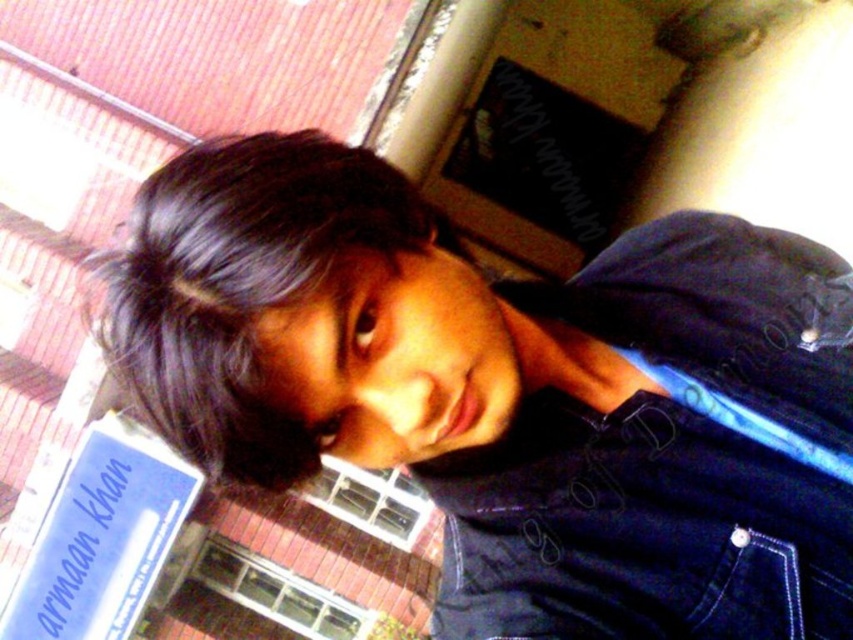
You are a photographer setting up a shoot. You need to place a 2.5 inch wide prop between the dark blue denim jacket at upper right and the navy blue denim jacket at lower right. Can you fit the prop between them without overlapping either jacket?

The distance between the dark blue denim jacket at upper right and the navy blue denim jacket at lower right is 1.71 inches, which is less than the 2.5 inch width of the prop. Therefore, the prop cannot be placed between them without overlapping either jacket.

You are a photographer trying to capture a portrait of the person in the image. You notice the dark blue denim jacket at upper right and the dark brown hair at upper left. Which object should you adjust your camera angle to focus on first if you want to ensure both are in frame?

The dark blue denim jacket at upper right is positioned under the dark brown hair at upper left. To ensure both are in frame, focus on the dark brown hair at upper left first since it is higher up and the jacket below it will naturally be included in the shot.

You are a photographer adjusting your camera settings. You want to ensure that the navy blue denim jacket at lower right is in focus while capturing the scene. Given that your camera has a depth of field of 60 centimeters, will the jacket be in focus?

The navy blue denim jacket at lower right and camera are 59.37 centimeters apart from each other. Since the distance is within the camera depth of field of 60 centimeters, the jacket will be in focus.